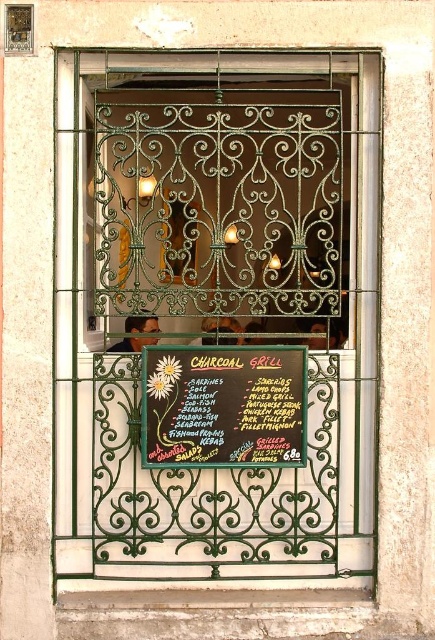
You are a delivery person trying to read the menu board displayed at the bottom of the green wrought iron gate. Can you see the black chalkboard at center clearly through the green wrought iron at center?

The green wrought iron at center is positioned over the black chalkboard at center, so the green wrought iron at center may block your view of the black chalkboard at center, making it difficult to read clearly.

You are standing in front of the building and want to walk towards the gate. There are two points marked on the ground in front of you at coordinates point (193, 273) and point (247, 374). Which point should you step on first to reach the gate?

You should step on point (247, 374) first because point (193, 273) is behind it, meaning point (247, 374) is closer to you.